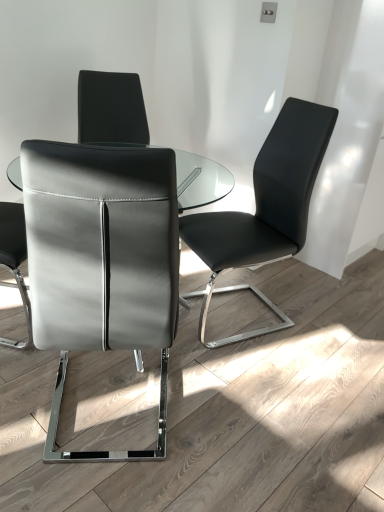
Locate an element on the screen. The height and width of the screenshot is (512, 384). free point in front of black leather chair at center, the second chair positioned from the left is located at coordinates (256, 379).